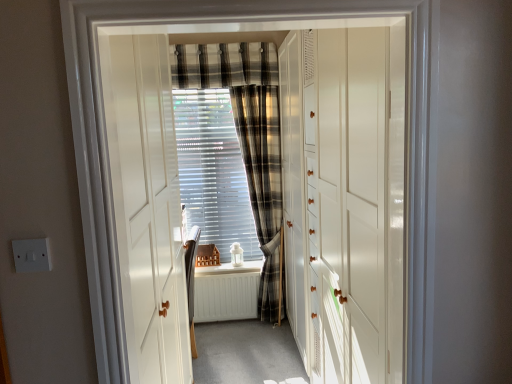
Question: From the image's perspective, is plaid fabric curtain at center, the second curtain when ordered from top to bottom, above white plastic switch at lower left?

Choices:
 (A) no
 (B) yes

Answer: (B)

Question: Does plaid fabric curtain at center, the second curtain when ordered from top to bottom, have a greater width compared to white plastic switch at lower left?

Choices:
 (A) no
 (B) yes

Answer: (B)

Question: Is plaid fabric curtain at center, the second curtain when ordered from top to bottom, looking in the opposite direction of white plastic switch at lower left?

Choices:
 (A) yes
 (B) no

Answer: (B)

Question: Is plaid fabric curtain at center, positioned as the 1th curtain in bottom-to-top order, thinner than white plastic switch at lower left?

Choices:
 (A) no
 (B) yes

Answer: (A)

Question: Is the depth of plaid fabric curtain at center, positioned as the 1th curtain in bottom-to-top order, less than that of white plastic switch at lower left?

Choices:
 (A) no
 (B) yes

Answer: (A)

Question: From the image's perspective, is white painted wood at center positioned above or below plaid fabric curtain at upper center, marked as the first curtain in a top-to-bottom arrangement?

Choices:
 (A) below
 (B) above

Answer: (A)

Question: In terms of size, does white painted wood at center appear bigger or smaller than plaid fabric curtain at upper center, which is the second curtain in bottom-to-top order?

Choices:
 (A) big
 (B) small

Answer: (B)

Question: In terms of height, does white painted wood at center look taller or shorter compared to plaid fabric curtain at upper center, which is the second curtain in bottom-to-top order?

Choices:
 (A) short
 (B) tall

Answer: (A)

Question: Is point (210, 271) closer or farther from the camera than point (219, 82)?

Choices:
 (A) closer
 (B) farther

Answer: (B)

Question: From the image's perspective, relative to translucent plastic blinds at center, is white painted wood at center above or below?

Choices:
 (A) above
 (B) below

Answer: (B)

Question: Is white painted wood at center bigger or smaller than translucent plastic blinds at center?

Choices:
 (A) big
 (B) small

Answer: (B)

Question: Is point (254, 264) closer or farther from the camera than point (233, 188)?

Choices:
 (A) farther
 (B) closer

Answer: (B)

Question: In terms of width, does white painted wood at center look wider or thinner when compared to translucent plastic blinds at center?

Choices:
 (A) thin
 (B) wide

Answer: (B)

Question: Based on their sizes in the image, would you say white glossy cabinet at center, which is the second door from front to back, is bigger or smaller than translucent plastic blinds at center?

Choices:
 (A) small
 (B) big

Answer: (B)

Question: Looking at their shapes, would you say white glossy cabinet at center, which is the second door from front to back, is wider or thinner than translucent plastic blinds at center?

Choices:
 (A) wide
 (B) thin

Answer: (A)